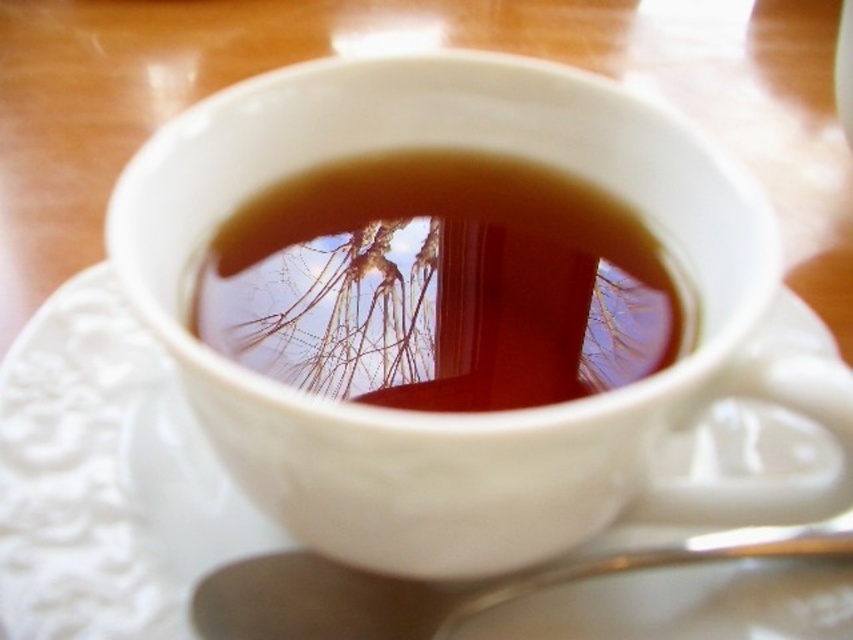
You are setting up a tea service and need to place the silver metallic spoon at lower center next to the white textured saucer at center. Given their sizes, will the spoon fit comfortably on the saucer?

The white textured saucer at center is larger in size than the silver metallic spoon at lower center, so the spoon will fit comfortably on the saucer.

You are a barista preparing a drink and notice the brown glossy liquid at center and the silver metallic spoon at lower center in the cup. Which object takes up more vertical space in the cup?

The brown glossy liquid at center is taller than the silver metallic spoon at lower center, so the liquid takes up more vertical space in the cup.